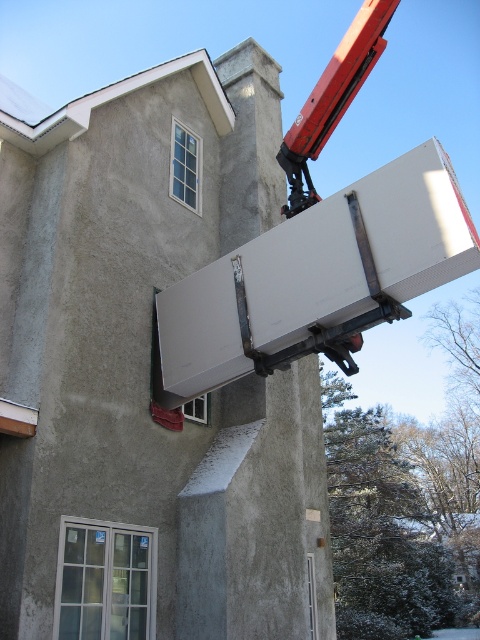
Question: Which point is closer to the camera taking this photo?

Choices:
 (A) (338, 227)
 (B) (372, 44)

Answer: (A)

Question: Does white matte refrigerator at upper center appear on the left side of metallic red crane at upper right?

Choices:
 (A) no
 (B) yes

Answer: (B)

Question: Which point is closer to the camera taking this photo?

Choices:
 (A) (385, 298)
 (B) (359, 77)

Answer: (A)

Question: Is white matte refrigerator at upper center below metallic red crane at upper right?

Choices:
 (A) no
 (B) yes

Answer: (B)

Question: Can you confirm if white matte refrigerator at upper center is wider than metallic red crane at upper right?

Choices:
 (A) yes
 (B) no

Answer: (B)